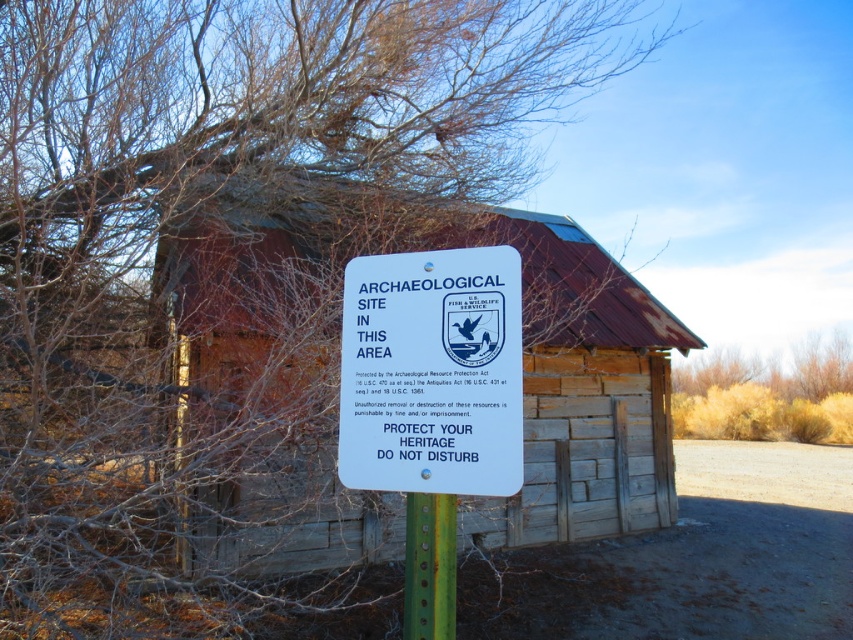
You are an archaeologist standing at the entrance of the weathered wood hut at center. You need to place a new marker at the exact center of the structure. Given the coordinates provided, where should you place the marker?

The weathered wood hut at center is located at point (337, 372), so you should place the marker at those coordinates to mark its center.

You are an archaeologist planning to place a new sign next to the existing ones. The new sign must be narrower than the green painted metal post at center. Can the white plastic sign at center be used as the new sign?

The white plastic sign at center is wider than the green painted metal post at center, so it cannot be used as the new sign since it exceeds the required width.